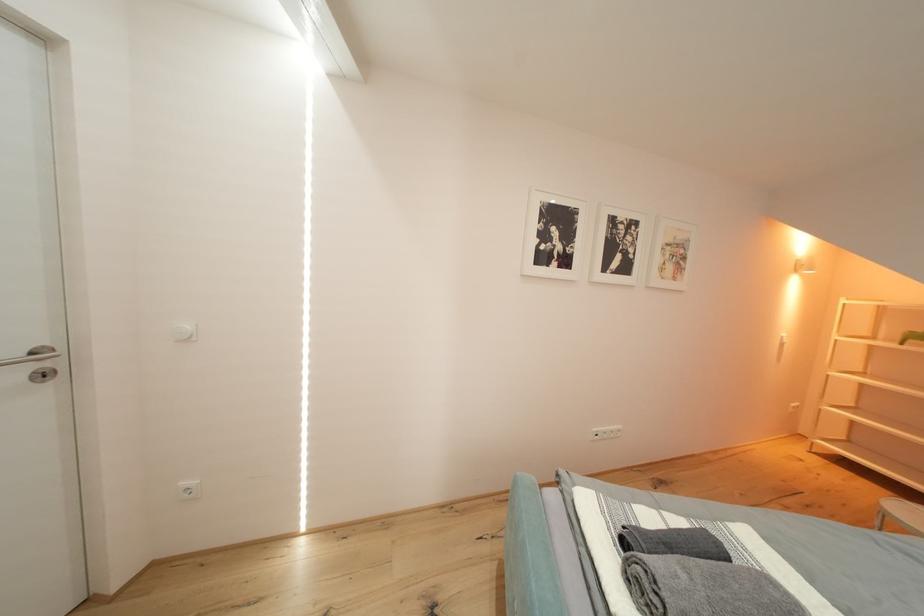
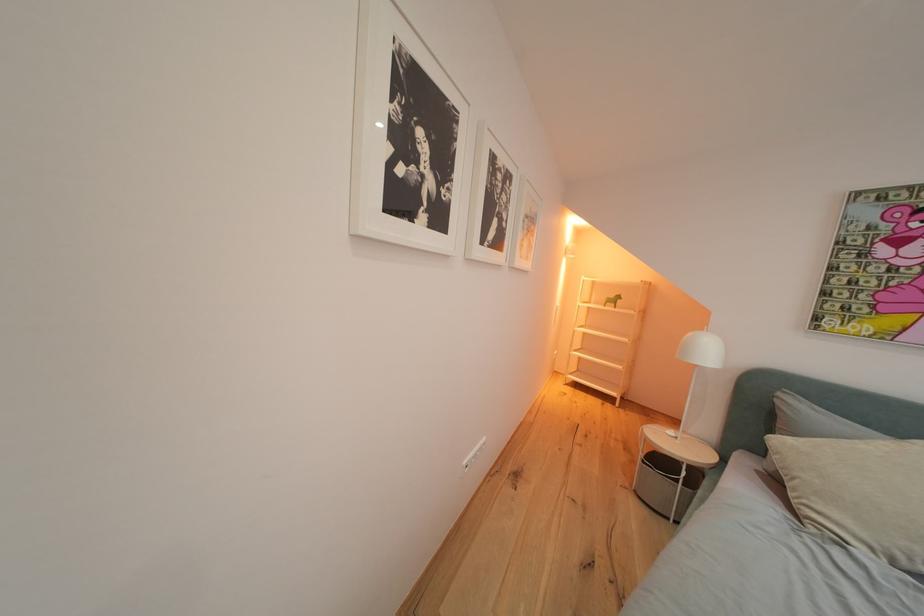
Question: The first image is from the beginning of the video and the second image is from the end. How did the camera likely rotate when shooting the video?

Choices:
 (A) Left
 (B) Right
 (C) Up
 (D) Down

Answer: (B)